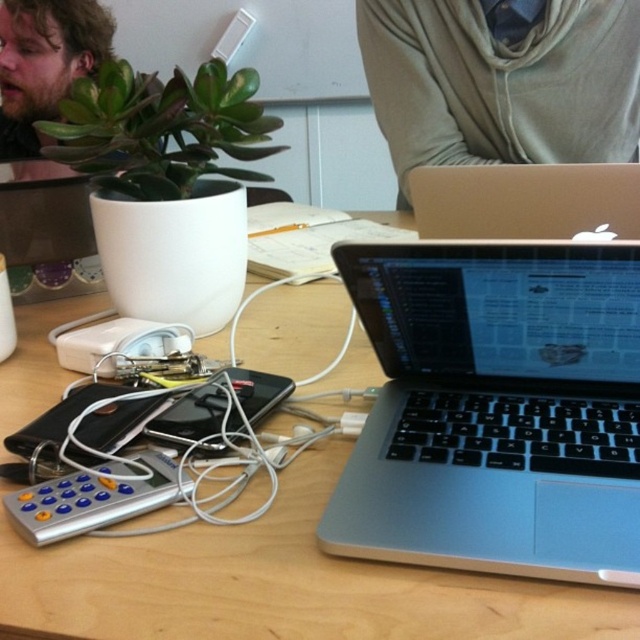
Question: Among these objects, which one is nearest to the camera?

Choices:
 (A) silver/black keyboard at center
 (B) silver/plastic remote at lower left
 (C) gray fabric scarf at upper center

Answer: (A)

Question: Which object is closer to the camera taking this photo?

Choices:
 (A) silver/plastic remote at lower left
 (B) bearded man at upper left
 (C) silver/black keyboard at center

Answer: (C)

Question: In this image, where is silver metallic laptop at center located relative to bearded man at upper left?

Choices:
 (A) left
 (B) right

Answer: (B)

Question: In this image, where is gray fabric scarf at upper center located relative to silver metallic laptop at center?

Choices:
 (A) left
 (B) right

Answer: (B)

Question: Does wooden table at center have a greater width compared to silver/plastic remote at lower left?

Choices:
 (A) no
 (B) yes

Answer: (B)

Question: Among these points, which one is nearest to the camera?

Choices:
 (A) (573, 60)
 (B) (100, 500)
 (C) (22, 72)
 (D) (605, 253)

Answer: (B)